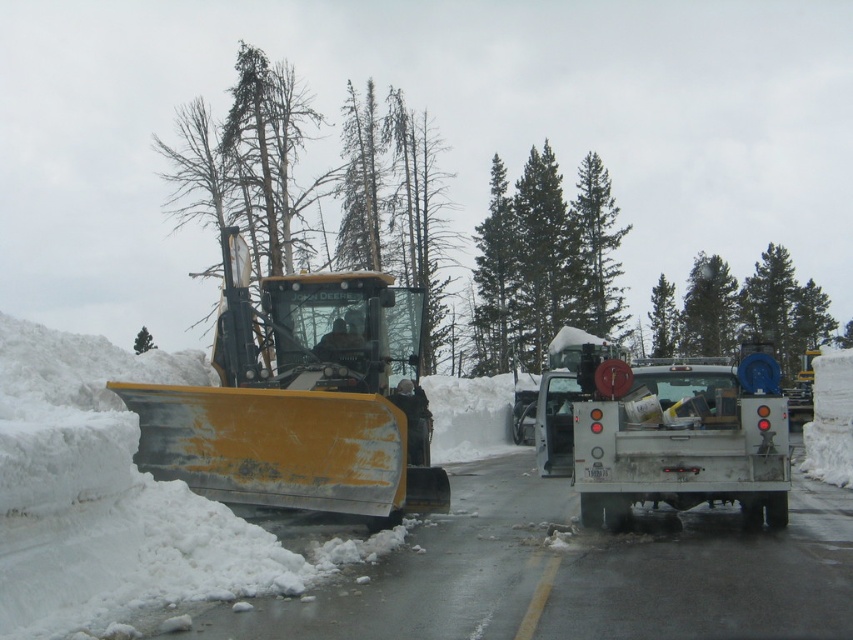
You are a snowplow operator who needs to clear snow from the road. You see a green matte tree at upper center and a green textured tree at center. Which tree is higher up in the image?

The green matte tree at upper center is higher up in the image than the green textured tree at center.

You are a snowplow operator who needs to clear snow from the road. You see a point marked at coordinates (595, 252). What object is located at that point?

The point at coordinates (595, 252) corresponds to a green textured pine tree at center.

You are a snowplow operator who needs to clear the road. You see the green coniferous trees at center and the green matte tree at upper left. Which tree is closer to the right side of the road?

The green coniferous trees at center are closer to the right side of the road because they are positioned to the right of the green matte tree at upper left.